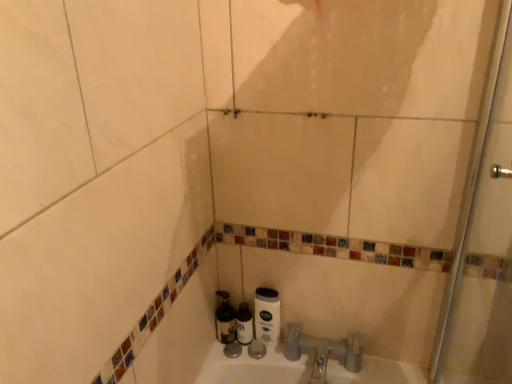
Question: Is white matte toilet paper at lower center positioned in front of metallic silver bottle at lower center, which ranks as the 1th bottle in left-to-right order?

Choices:
 (A) yes
 (B) no

Answer: (A)

Question: Can we say white matte toilet paper at lower center lies outside metallic silver bottle at lower center, the 2th bottle positioned from the right?

Choices:
 (A) no
 (B) yes

Answer: (B)

Question: From a real-world perspective, is white matte toilet paper at lower center located higher than metallic silver bottle at lower center, the 2th bottle positioned from the right?

Choices:
 (A) yes
 (B) no

Answer: (A)

Question: Can you confirm if white matte toilet paper at lower center is bigger than metallic silver bottle at lower center, the 2th bottle positioned from the right?

Choices:
 (A) no
 (B) yes

Answer: (A)

Question: From the image's perspective, would you say white matte toilet paper at lower center is shown under metallic silver bottle at lower center, the 2th bottle positioned from the right?

Choices:
 (A) no
 (B) yes

Answer: (A)

Question: From the image's perspective, does white matte toilet paper at lower center appear higher than metallic silver bottle at lower center, the 2th bottle positioned from the right?

Choices:
 (A) no
 (B) yes

Answer: (B)

Question: Could you tell me if transparent glass shower door at right is turned towards translucent plastic bottle at center, the first bottle positioned from the right?

Choices:
 (A) no
 (B) yes

Answer: (A)

Question: From the image's perspective, is transparent glass shower door at right above translucent plastic bottle at center, the first bottle positioned from the right?

Choices:
 (A) no
 (B) yes

Answer: (B)

Question: Would you say transparent glass shower door at right is outside translucent plastic bottle at center, the first bottle positioned from the right?

Choices:
 (A) no
 (B) yes

Answer: (B)

Question: Considering the relative sizes of transparent glass shower door at right and translucent plastic bottle at center, the 2th bottle positioned from the left, in the image provided, is transparent glass shower door at right bigger than translucent plastic bottle at center, the 2th bottle positioned from the left,?

Choices:
 (A) yes
 (B) no

Answer: (A)

Question: Does transparent glass shower door at right touch translucent plastic bottle at center, the 2th bottle positioned from the left?

Choices:
 (A) yes
 (B) no

Answer: (B)

Question: Can you confirm if transparent glass shower door at right is positioned to the left of translucent plastic bottle at center, the 2th bottle positioned from the left?

Choices:
 (A) yes
 (B) no

Answer: (B)

Question: From the image's perspective, is translucent plastic bottle at center, the first bottle positioned from the right, over metallic silver bottle at lower center, which ranks as the 1th bottle in left-to-right order?

Choices:
 (A) no
 (B) yes

Answer: (A)